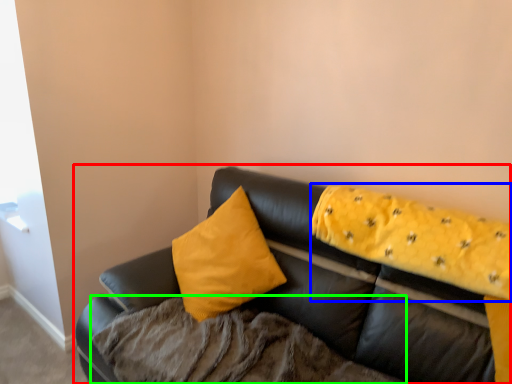
Question: Considering the real-world distances, which object is closest to studio couch (highlighted by a red box)? blanket (highlighted by a blue box) or bedding (highlighted by a green box).

Choices:
 (A) blanket
 (B) bedding

Answer: (A)